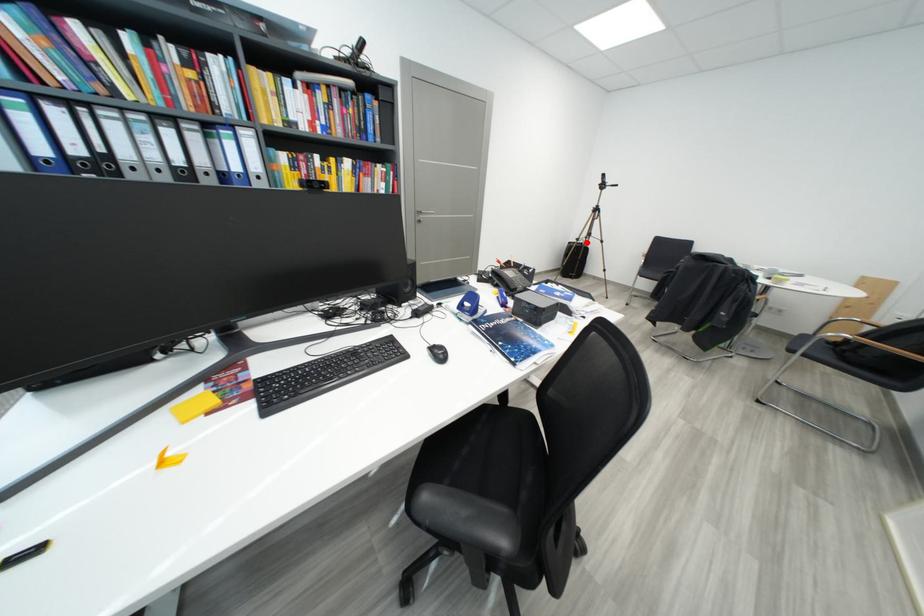
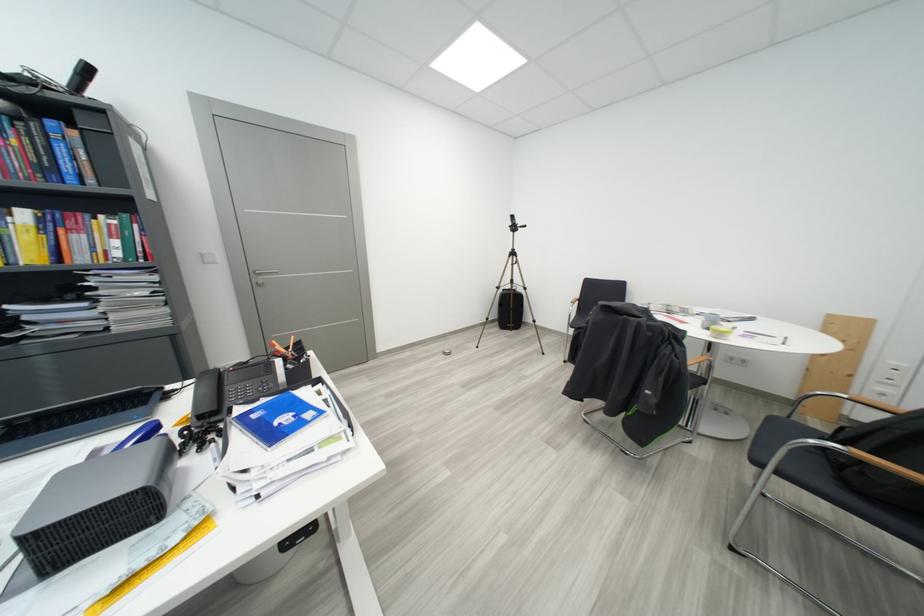
Find the pixel in the second image that matches the highlighted location in the first image.

(506, 291)